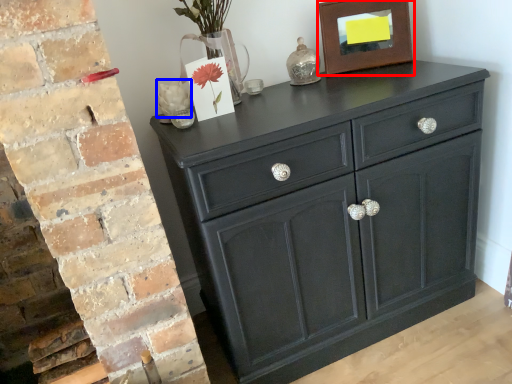
Question: Which object is closer to the camera taking this photo, picture frame (highlighted by a red box) or flower (highlighted by a blue box)?

Choices:
 (A) picture frame
 (B) flower

Answer: (B)